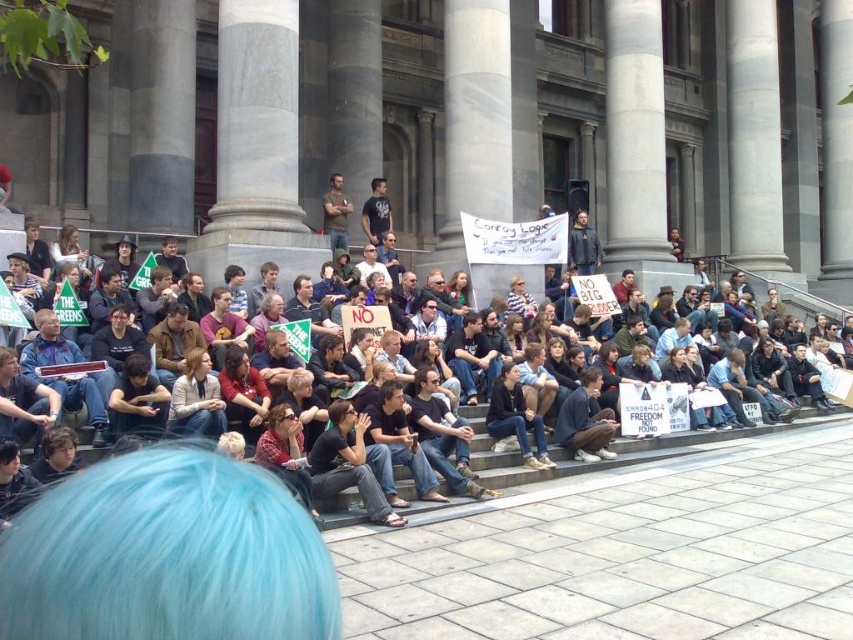
Question: Does dark brown leather jacket at center have a smaller size compared to black t-shirt at center?

Choices:
 (A) no
 (B) yes

Answer: (A)

Question: Which point is closer to the camera taking this photo?

Choices:
 (A) (492, 458)
 (B) (363, 205)

Answer: (A)

Question: Which point is closer to the camera?

Choices:
 (A) (372, 212)
 (B) (323, 225)
 (C) (403, 472)

Answer: (C)

Question: Is matte black sign at center above dark brown leather jacket at center?

Choices:
 (A) yes
 (B) no

Answer: (B)

Question: Does matte black sign at center appear over black t-shirt at center?

Choices:
 (A) no
 (B) yes

Answer: (A)

Question: Which point is farther from the camera taking this photo?

Choices:
 (A) (367, 236)
 (B) (332, 179)

Answer: (B)